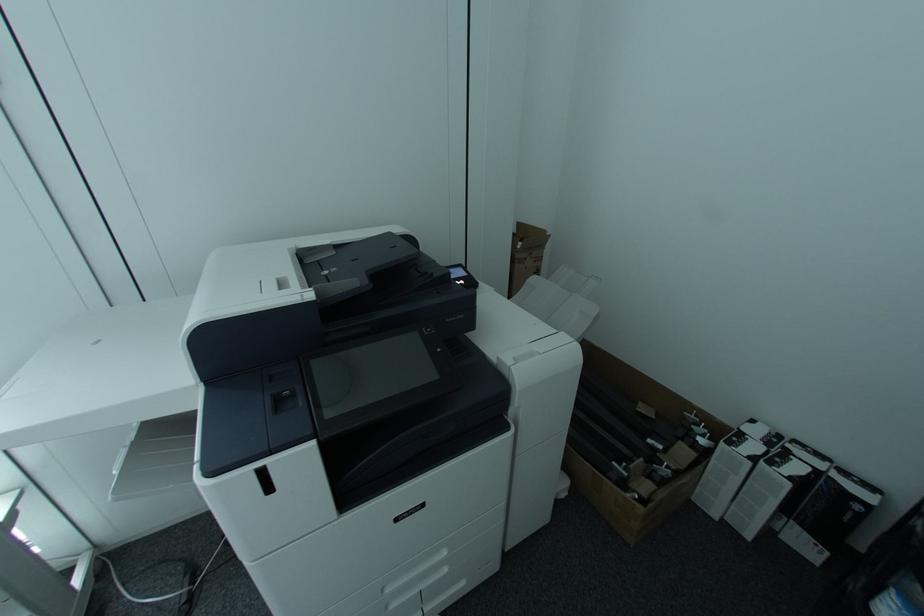
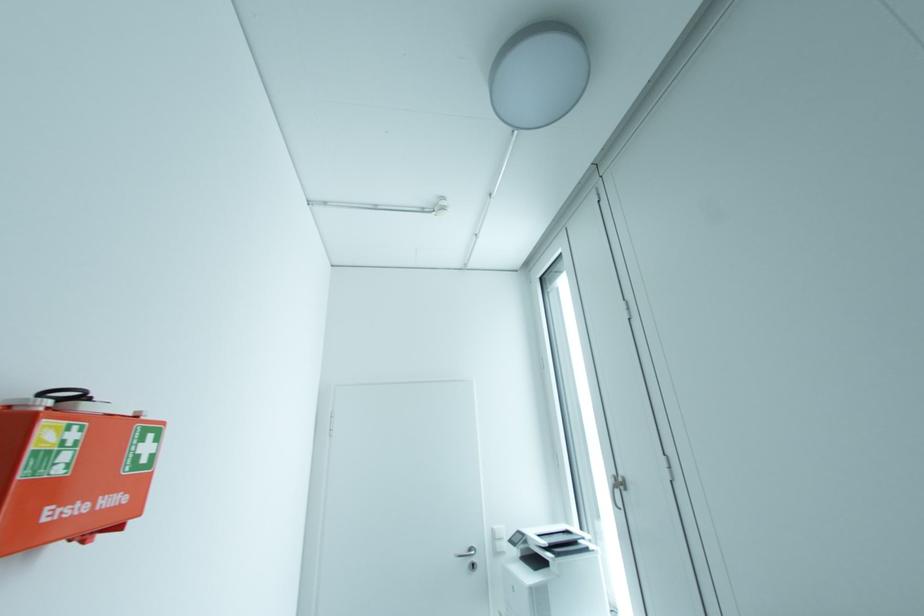
Question: The camera is either moving clockwise (left) or counter-clockwise (right) around the object. The first image is from the beginning of the video and the second image is from the end. Is the camera moving left or right when shooting the video?

Choices:
 (A) Left
 (B) Right

Answer: (B)